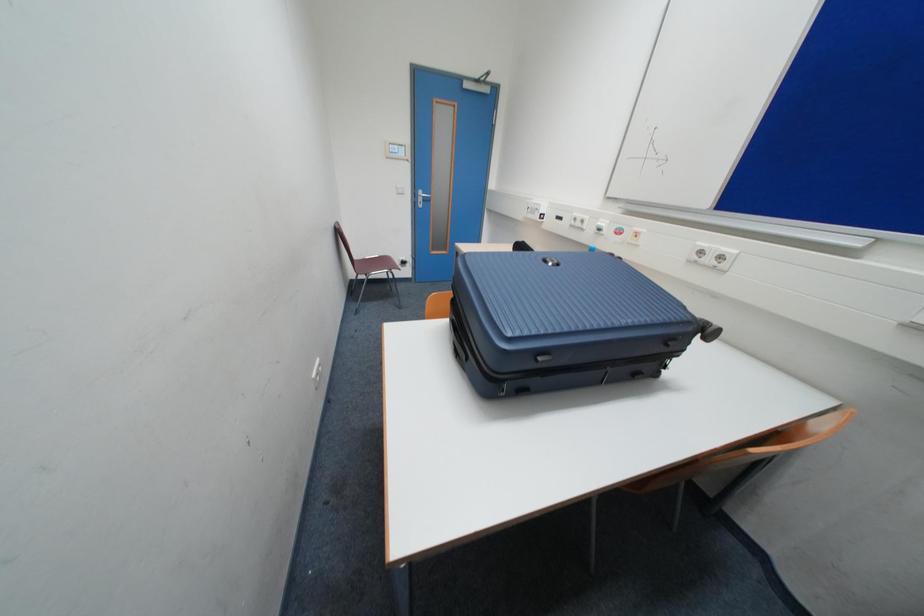
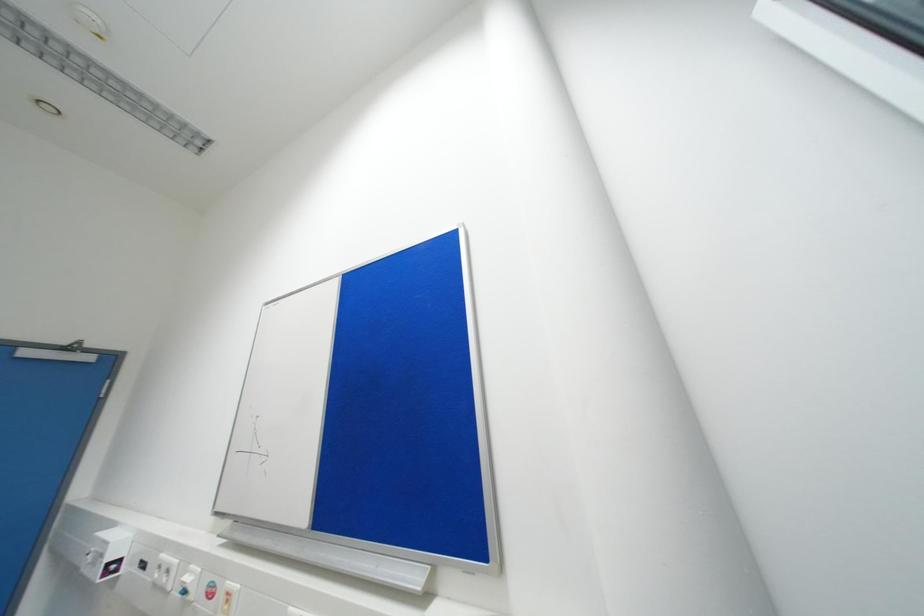
First-person continuous shooting, in which direction is the camera rotating?

The camera's rotation is toward right-up.